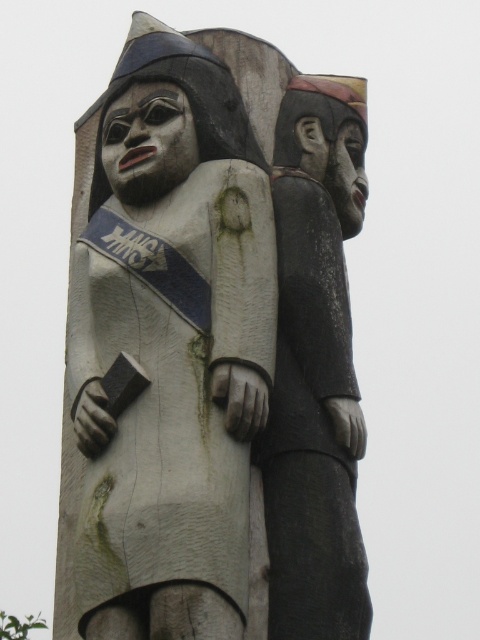
Question: Does wooden totem pole at center appear over dark gray wood figure at right?

Choices:
 (A) yes
 (B) no

Answer: (A)

Question: Can you confirm if wooden totem pole at center is positioned below dark gray wood figure at right?

Choices:
 (A) no
 (B) yes

Answer: (A)

Question: From the image, what is the correct spatial relationship of wooden totem pole at center in relation to dark gray wood figure at right?

Choices:
 (A) above
 (B) below

Answer: (A)

Question: Which object appears closest to the camera in this image?

Choices:
 (A) wooden totem pole at center
 (B) dark gray wood figure at right

Answer: (A)

Question: Among these objects, which one is nearest to the camera?

Choices:
 (A) wooden totem pole at center
 (B) dark gray wood figure at right

Answer: (A)